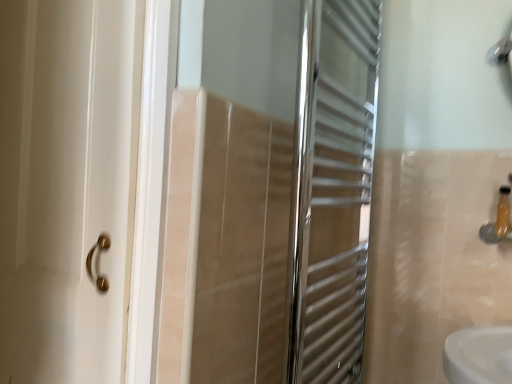
Question: From a real-world perspective, is polished chrome towel rack at center located higher than translucent plastic bottle at right?

Choices:
 (A) no
 (B) yes

Answer: (B)

Question: Is translucent plastic bottle at right at the back of polished chrome towel rack at center?

Choices:
 (A) yes
 (B) no

Answer: (B)

Question: From the image's perspective, is polished chrome towel rack at center located beneath translucent plastic bottle at right?

Choices:
 (A) yes
 (B) no

Answer: (B)

Question: Are polished chrome towel rack at center and translucent plastic bottle at right beside each other?

Choices:
 (A) yes
 (B) no

Answer: (B)

Question: Is polished chrome towel rack at center to the left of translucent plastic bottle at right from the viewer's perspective?

Choices:
 (A) yes
 (B) no

Answer: (A)

Question: Is polished chrome towel rack at center smaller than translucent plastic bottle at right?

Choices:
 (A) no
 (B) yes

Answer: (A)

Question: From the image's perspective, is translucent plastic bottle at right under polished chrome towel rack at center?

Choices:
 (A) yes
 (B) no

Answer: (A)

Question: From the image's perspective, is translucent plastic bottle at right on polished chrome towel rack at center?

Choices:
 (A) no
 (B) yes

Answer: (A)

Question: Considering the relative sizes of translucent plastic bottle at right and polished chrome towel rack at center in the image provided, is translucent plastic bottle at right smaller than polished chrome towel rack at center?

Choices:
 (A) yes
 (B) no

Answer: (A)

Question: Considering the relative sizes of translucent plastic bottle at right and polished chrome towel rack at center in the image provided, is translucent plastic bottle at right thinner than polished chrome towel rack at center?

Choices:
 (A) yes
 (B) no

Answer: (A)

Question: Can you confirm if translucent plastic bottle at right is positioned to the left of polished chrome towel rack at center?

Choices:
 (A) yes
 (B) no

Answer: (B)

Question: Is there a large distance between translucent plastic bottle at right and polished chrome towel rack at center?

Choices:
 (A) yes
 (B) no

Answer: (B)

Question: Is translucent plastic bottle at right wider or thinner than polished chrome towel rack at center?

Choices:
 (A) wide
 (B) thin

Answer: (B)